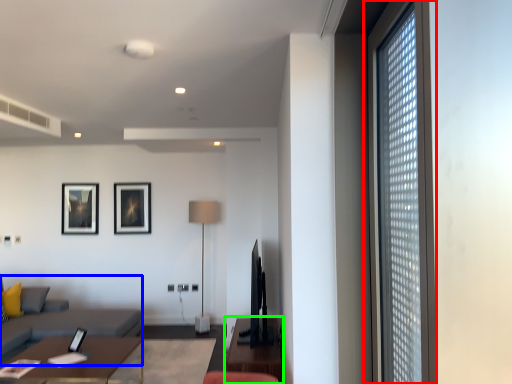
Question: Which object is positioned farthest from window (highlighted by a red box)? Select from couch (highlighted by a blue box) and table (highlighted by a green box).

Choices:
 (A) couch
 (B) table

Answer: (A)